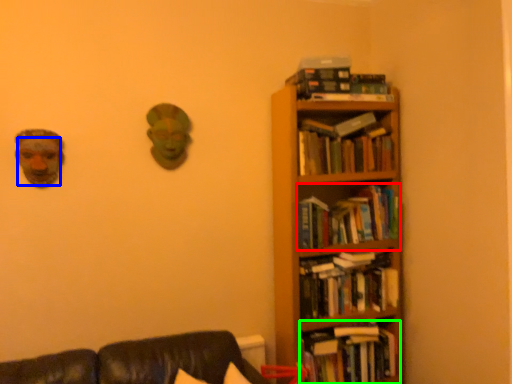
Question: Which object is the closest to the book (highlighted by a red box)? Choose among these: human face (highlighted by a blue box) or book (highlighted by a green box).

Choices:
 (A) human face
 (B) book

Answer: (B)